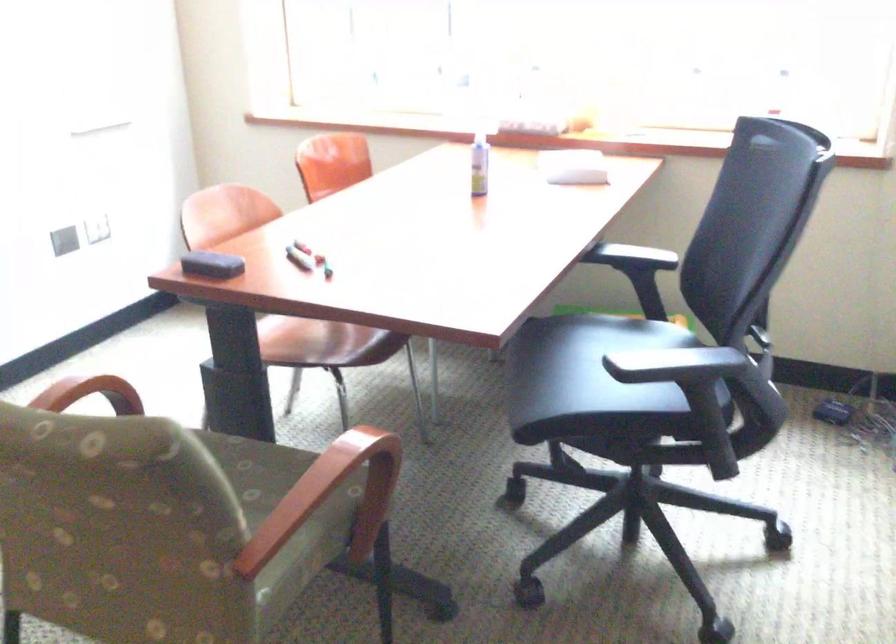
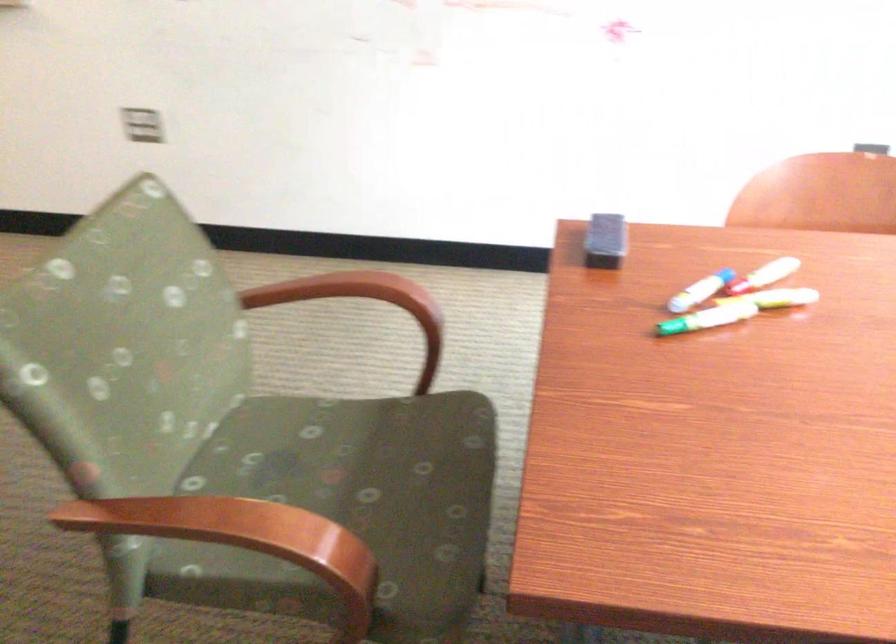
The point at (330,245) is marked in the first image. Where is the corresponding point in the second image?

(776, 298)